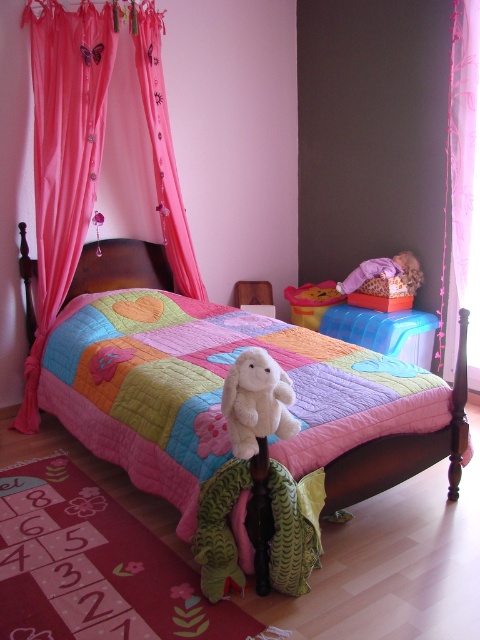
Where is the patchwork quilt at center located in the image?

The patchwork quilt at center is located at point (x=399, y=452) in the image.

Consider the image. You are standing in the child bedroom and want to locate the point at coordinate (464, 184). According to the scene description, where exactly is this point located?

The point at coordinate (464, 184) is located on the pink sheer curtain at right.

You are standing in the center of the child bedroom. You see a point marked at coordinate [399,452]. What object is located at that point?

The point at coordinate [399,452] marks the location of the patchwork quilt at center.